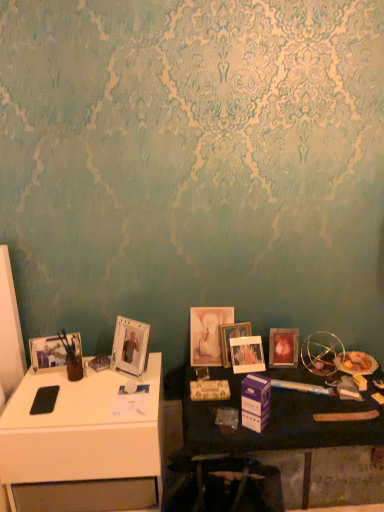
Describe the element at coordinates (55, 351) in the screenshot. I see `matte silver picture frame at left, acting as the first picture frame starting from the left` at that location.

How much space does matte glass photo frame at center, which is counted as the third picture frame, starting from the right, occupy vertically?

matte glass photo frame at center, which is counted as the third picture frame, starting from the right, is 10.19 inches tall.

Measure the distance between matte glass photo frame at center, arranged as the 4th picture frame when viewed from the left, and camera.

The depth of matte glass photo frame at center, arranged as the 4th picture frame when viewed from the left, is 2.03 meters.

What do you see at coordinates (130, 346) in the screenshot? The width and height of the screenshot is (384, 512). I see `clear plastic picture frame at left, the 5th picture frame viewed from the right` at bounding box center [130, 346].

Where is `white glossy desk at left`? Image resolution: width=384 pixels, height=512 pixels. white glossy desk at left is located at coordinates (84, 444).

Which is in front, matte glass picture frame at center, acting as the fourth picture frame starting from the right, or white glossy desk at left?

white glossy desk at left is more forward.

Is point (218, 321) closer to viewer compared to point (36, 504)?

No, it is not.

From a real-world perspective, is matte glass picture frame at center, acting as the fourth picture frame starting from the right, under white glossy desk at left?

No, from a real-world perspective, matte glass picture frame at center, acting as the fourth picture frame starting from the right, is not below white glossy desk at left.

Could you tell me if matte glass picture frame at center, the third picture frame when ordered from left to right, is facing white glossy desk at left?

No.

How much distance is there between white glossy desk at left and clear plastic picture frame at left, the 5th picture frame viewed from the right?

white glossy desk at left and clear plastic picture frame at left, the 5th picture frame viewed from the right, are 11.96 inches apart.

Is there a large distance between white glossy desk at left and clear plastic picture frame at left, the 5th picture frame viewed from the right?

That's not correct — white glossy desk at left is a little close to clear plastic picture frame at left, the 5th picture frame viewed from the right.

Could you tell me if white glossy desk at left is turned towards clear plastic picture frame at left, the 5th picture frame viewed from the right?

No, white glossy desk at left does not turn towards clear plastic picture frame at left, the 5th picture frame viewed from the right.

Can we say white glossy desk at left lies outside clear plastic picture frame at left, the 5th picture frame viewed from the right?

white glossy desk at left lies outside clear plastic picture frame at left, the 5th picture frame viewed from the right,'s area.

Is clear plastic picture frame at left, which appears as the second picture frame when viewed from the left, beside matte glass picture frame at center right, the 6th picture frame in the left-to-right sequence?

No, clear plastic picture frame at left, which appears as the second picture frame when viewed from the left, is not beside matte glass picture frame at center right, the 6th picture frame in the left-to-right sequence.

Between point (143, 355) and point (292, 356), which one is positioned in front?

The point (143, 355) is closer to the camera.

How distant is clear plastic picture frame at left, which appears as the second picture frame when viewed from the left, from matte glass picture frame at center right, the 6th picture frame in the left-to-right sequence?

clear plastic picture frame at left, which appears as the second picture frame when viewed from the left, and matte glass picture frame at center right, the 6th picture frame in the left-to-right sequence, are 26.15 inches apart from each other.

Looking at this image, is white glossy desk at left positioned behind matte glass picture frame at center, the third picture frame when ordered from left to right?

No.

Identify the location of the 5th picture frame behind the white glossy desk at left, counting from the anchor's position. The width and height of the screenshot is (384, 512). (207, 334).

From a real-world perspective, who is located higher, white glossy desk at left or matte glass picture frame at center, acting as the fourth picture frame starting from the right?

matte glass picture frame at center, acting as the fourth picture frame starting from the right, from a real-world perspective.

Based on the photo, considering the positions of objects white glossy desk at left and matte glass picture frame at center, the third picture frame when ordered from left to right, in the image provided, who is more to the left, white glossy desk at left or matte glass picture frame at center, the third picture frame when ordered from left to right,?

From the viewer's perspective, white glossy desk at left appears more on the left side.

From the image's perspective, which one is positioned lower, matte glass picture frame at center, the third picture frame when ordered from left to right, or matte white picture frame at center, the 5th picture frame positioned from the left?

matte white picture frame at center, the 5th picture frame positioned from the left, appears lower in the image.

Between point (196, 366) and point (247, 349), which one is positioned behind?

Positioned behind is point (196, 366).

Considering the positions of objects matte glass picture frame at center, the third picture frame when ordered from left to right, and matte white picture frame at center, the 5th picture frame positioned from the left, in the image provided, who is more to the right, matte glass picture frame at center, the third picture frame when ordered from left to right, or matte white picture frame at center, the 5th picture frame positioned from the left,?

matte white picture frame at center, the 5th picture frame positioned from the left.

From the image's perspective, which picture frame is the 3rd one above the matte white picture frame at center, the 5th picture frame positioned from the left? Please provide its 2D coordinates.

[(55, 351)]

Looking at this image, from a real-world perspective, is matte white picture frame at center, acting as the second picture frame starting from the right, beneath matte silver picture frame at left, acting as the first picture frame starting from the left?

Correct, in the physical world, matte white picture frame at center, acting as the second picture frame starting from the right, is lower than matte silver picture frame at left, acting as the first picture frame starting from the left.

Is matte white picture frame at center, acting as the second picture frame starting from the right, smaller than matte silver picture frame at left, marked as the 6th picture frame in a right-to-left arrangement?

Incorrect, matte white picture frame at center, acting as the second picture frame starting from the right, is not smaller in size than matte silver picture frame at left, marked as the 6th picture frame in a right-to-left arrangement.

Are matte white picture frame at center, the 5th picture frame positioned from the left, and matte silver picture frame at left, acting as the first picture frame starting from the left, far apart?

No.

Is matte silver picture frame at left, acting as the first picture frame starting from the left, not near matte glass picture frame at center, acting as the fourth picture frame starting from the right?

No, there isn't a large distance between matte silver picture frame at left, acting as the first picture frame starting from the left, and matte glass picture frame at center, acting as the fourth picture frame starting from the right.

Is matte silver picture frame at left, marked as the 6th picture frame in a right-to-left arrangement, to the left of matte glass picture frame at center, the third picture frame when ordered from left to right, from the viewer's perspective?

Correct, you'll find matte silver picture frame at left, marked as the 6th picture frame in a right-to-left arrangement, to the left of matte glass picture frame at center, the third picture frame when ordered from left to right.

Locate an element on the screen. This screenshot has height=512, width=384. the 2nd picture frame to the left of the matte glass picture frame at center, acting as the fourth picture frame starting from the right, counting from the anchor's position is located at coordinates (55, 351).

Is point (73, 335) less distant than point (204, 330)?

That is True.

Where is `desk that appears on the left of matte glass picture frame at center, the third picture frame when ordered from left to right`? The image size is (384, 512). desk that appears on the left of matte glass picture frame at center, the third picture frame when ordered from left to right is located at coordinates (84, 444).

Where is `the 1st picture frame counting from the right of the white glossy desk at left`? the 1st picture frame counting from the right of the white glossy desk at left is located at coordinates (130, 346).

Based on their spatial positions, is matte glass picture frame at center, the third picture frame when ordered from left to right, or matte silver picture frame at left, marked as the 6th picture frame in a right-to-left arrangement, further from matte glass picture frame at center right, the 6th picture frame in the left-to-right sequence?

matte silver picture frame at left, marked as the 6th picture frame in a right-to-left arrangement.

When comparing their distances from matte silver picture frame at left, marked as the 6th picture frame in a right-to-left arrangement, does matte glass photo frame at center, arranged as the 4th picture frame when viewed from the left, or wooden table at lower right seem closer?

Based on the image, matte glass photo frame at center, arranged as the 4th picture frame when viewed from the left, appears to be nearer to matte silver picture frame at left, marked as the 6th picture frame in a right-to-left arrangement.

Estimate the real-world distances between objects in this image. Which object is further from wooden table at lower right, matte glass photo frame at center, which is counted as the third picture frame, starting from the right, or matte glass picture frame at center, the third picture frame when ordered from left to right?

matte glass photo frame at center, which is counted as the third picture frame, starting from the right, is positioned further to the anchor wooden table at lower right.

From the image, which object appears to be farther from matte glass photo frame at center, which is counted as the third picture frame, starting from the right, clear plastic picture frame at left, the 5th picture frame viewed from the right, or wooden table at lower right?

wooden table at lower right is positioned further to the anchor matte glass photo frame at center, which is counted as the third picture frame, starting from the right.

Estimate the real-world distances between objects in this image. Which object is closer to matte glass photo frame at center, which is counted as the third picture frame, starting from the right, matte glass picture frame at center, the third picture frame when ordered from left to right, or matte white picture frame at center, acting as the second picture frame starting from the right?

Among the two, matte white picture frame at center, acting as the second picture frame starting from the right, is located nearer to matte glass photo frame at center, which is counted as the third picture frame, starting from the right.

From the picture: Considering their positions, is matte white picture frame at center, acting as the second picture frame starting from the right, positioned closer to matte glass picture frame at center, acting as the fourth picture frame starting from the right, than clear plastic picture frame at left, the 5th picture frame viewed from the right?

Among the two, matte white picture frame at center, acting as the second picture frame starting from the right, is located nearer to matte glass picture frame at center, acting as the fourth picture frame starting from the right.

Estimate the real-world distances between objects in this image. Which object is further from matte white picture frame at center, acting as the second picture frame starting from the right, white glossy desk at left or matte glass photo frame at center, which is counted as the third picture frame, starting from the right?

white glossy desk at left.

From the image, which object appears to be nearer to matte glass photo frame at center, which is counted as the third picture frame, starting from the right, white glossy desk at left or wooden table at lower right?

wooden table at lower right lies closer to matte glass photo frame at center, which is counted as the third picture frame, starting from the right, than the other object.

Locate an element on the screen. The width and height of the screenshot is (384, 512). picture frame between matte silver picture frame at left, marked as the 6th picture frame in a right-to-left arrangement, and matte glass picture frame at center, the third picture frame when ordered from left to right, in the horizontal direction is located at coordinates (130, 346).

Where is `desk located between matte silver picture frame at left, acting as the first picture frame starting from the left, and matte glass picture frame at center, the third picture frame when ordered from left to right, in the left-right direction`? Image resolution: width=384 pixels, height=512 pixels. desk located between matte silver picture frame at left, acting as the first picture frame starting from the left, and matte glass picture frame at center, the third picture frame when ordered from left to right, in the left-right direction is located at coordinates (84, 444).

Identify the location of picture frame between matte glass photo frame at center, which is counted as the third picture frame, starting from the right, and matte glass picture frame at center right, the 6th picture frame in the left-to-right sequence, from left to right. (247, 354).

The image size is (384, 512). In order to click on picture frame between clear plastic picture frame at left, the 5th picture frame viewed from the right, and matte glass photo frame at center, arranged as the 4th picture frame when viewed from the left, from left to right in this screenshot , I will do `click(207, 334)`.